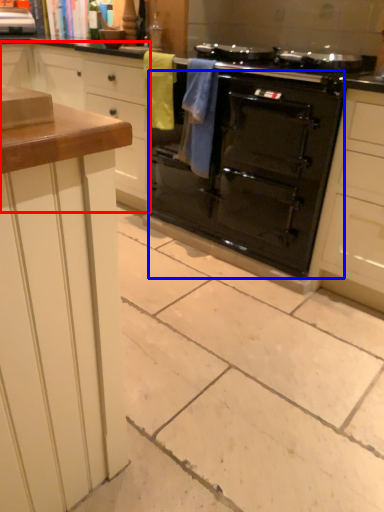
Question: Which object is further to the camera taking this photo, cabinetry (highlighted by a red box) or oven (highlighted by a blue box)?

Choices:
 (A) cabinetry
 (B) oven

Answer: (A)